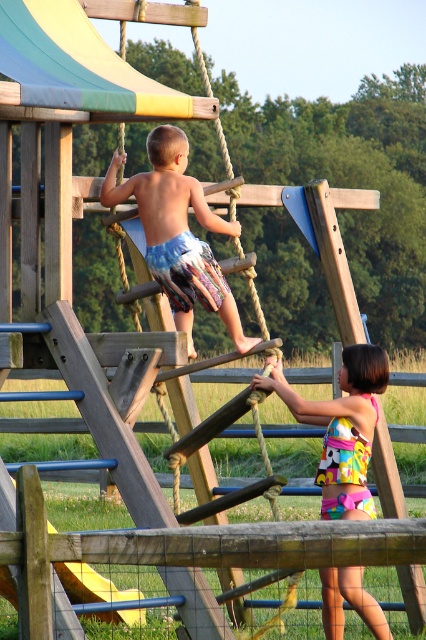
In the scene shown: You are standing at the playground and see two points marked in the image. Which point, point (184, 269) or point (317, 472), is closer to you?

Point (184, 269) is closer to the viewer than point (317, 472).

You are standing at the entrance of the playground and want to locate the multicolored plastic slide at upper left. According to the scene description, where should you look?

The multicolored plastic slide at upper left is located at point [74,64], so you should look towards the upper left area of the scene to find it.

You are a photographer trying to capture a photo of both the blue patterned shorts at center and the multicolored fabric swimsuit at center in the playground scene. Since you want to ensure both are clearly visible, which object should you focus on first considering their heights?

The blue patterned shorts at center has a greater height compared to the multicolored fabric swimsuit at center, so you should focus on the blue patterned shorts at center first to ensure both are in frame.